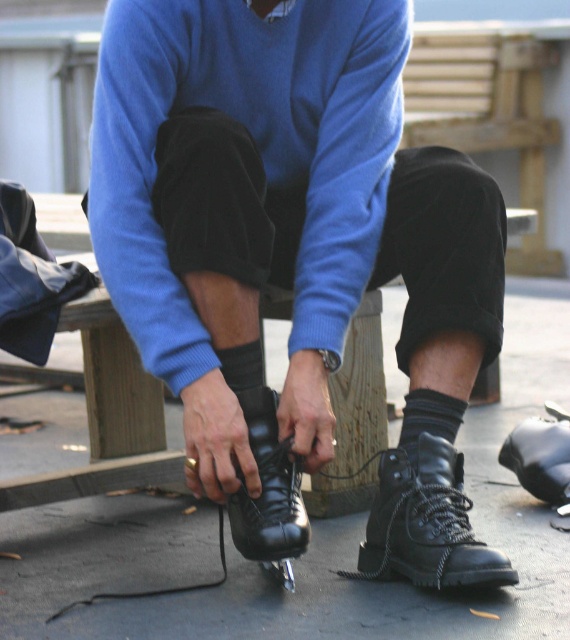
Who is more forward, (x=390, y=570) or (x=258, y=560)?

Point (x=258, y=560) is in front.

Is black leather boot at lower center behind black leather skate at center?

No.

Is point (441, 529) closer to viewer compared to point (299, 506)?

Yes, point (441, 529) is in front of point (299, 506).

Locate an element on the screen. black leather boot at lower center is located at coordinates (426, 524).

Can you confirm if shiny black ice skate at center is thinner than black leather boot at lower center?

No.

From the picture: Measure the distance between shiny black ice skate at center and black leather boot at lower center.

They are 9.59 inches apart.

Where is `shiny black ice skate at center`? Image resolution: width=570 pixels, height=640 pixels. shiny black ice skate at center is located at coordinates (295, 253).

Between point (99, 144) and point (260, 524), which one is positioned in front?

Point (99, 144)

Can you confirm if shiny black ice skate at center is smaller than black leather skate at center?

Incorrect, shiny black ice skate at center is not smaller in size than black leather skate at center.

This screenshot has width=570, height=640. In order to click on shiny black ice skate at center in this screenshot , I will do `click(295, 253)`.